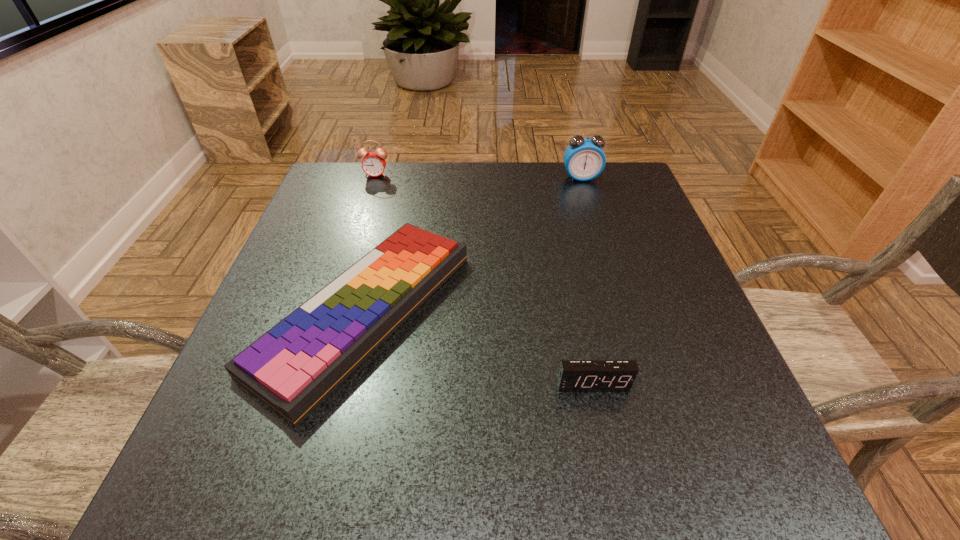
What are the coordinates of `the tallest object` in the screenshot? It's located at [x=584, y=159].

This screenshot has height=540, width=960. What are the coordinates of `the leftmost alarm clock` in the screenshot? It's located at 373,164.

At what (x,y) coordinates should I click in order to perform the action: click on the second tallest object. Please return your answer as a coordinate pair (x, y). Looking at the image, I should click on (373, 164).

Find the location of `the nearest alarm clock`. the nearest alarm clock is located at coordinates (574, 375).

Locate an element on the screen. This screenshot has width=960, height=540. computer keyboard is located at coordinates (293, 367).

This screenshot has height=540, width=960. I want to click on vacant space located on the face of the tallest alarm clock, so click(x=606, y=256).

Locate an element on the screen. This screenshot has width=960, height=540. free space located on the clock face of the second tallest object is located at coordinates (350, 253).

Locate an element on the screen. This screenshot has width=960, height=540. vacant space located 0.150m on the front-facing side of the shortest alarm clock is located at coordinates (615, 490).

Identify the location of vacant space located 0.310m on the back of the computer keyboard. (401, 164).

The width and height of the screenshot is (960, 540). In order to click on alarm clock present at the left edge in this screenshot , I will do point(373,164).